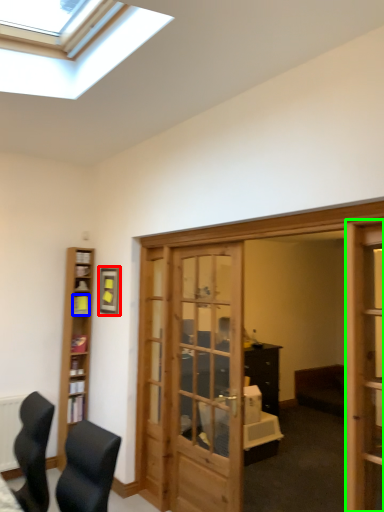
Question: Based on their relative distances, which object is farther from picture frame (highlighted by a red box)? Choose from shelf (highlighted by a blue box) and screen door (highlighted by a green box).

Choices:
 (A) shelf
 (B) screen door

Answer: (B)